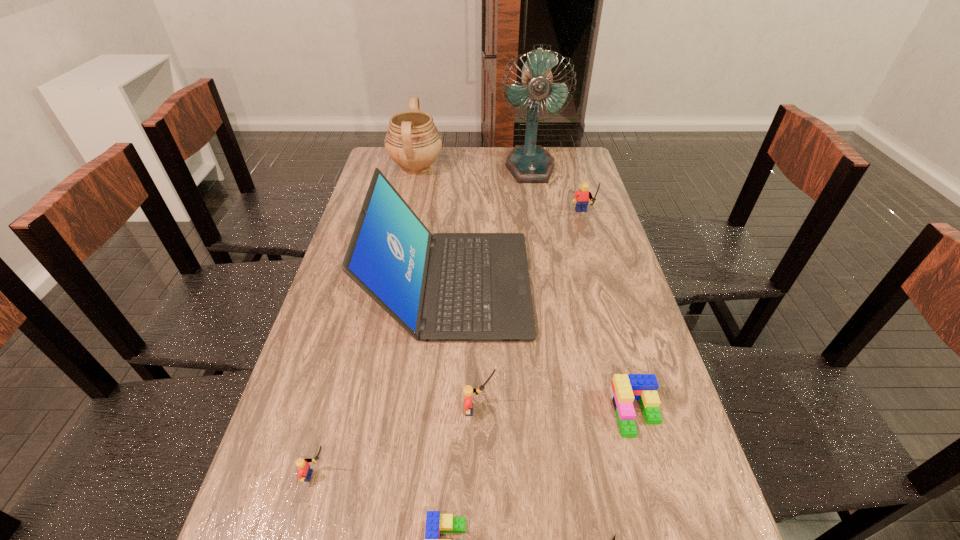
You are a GUI agent. You are given a task and a screenshot of the screen. Output one action in this format:
    pyautogui.click(x=<x>, y=<y>)
    Task: Click on the third closest Lego relative to the second farthest yellow Lego
    This screenshot has height=540, width=960.
    Given the screenshot: What is the action you would take?
    pyautogui.click(x=304, y=473)

Find the location of `yellow Lego object that ranks as the closest to the tallest object`. yellow Lego object that ranks as the closest to the tallest object is located at coordinates (581, 198).

Point out which yellow Lego is positioned as the second nearest to the second shortest object. Please provide its 2D coordinates. Your answer should be formatted as a tuple, i.e. [(x, y)], where the tuple contains the x and y coordinates of a point satisfying the conditions above.

[(304, 473)]